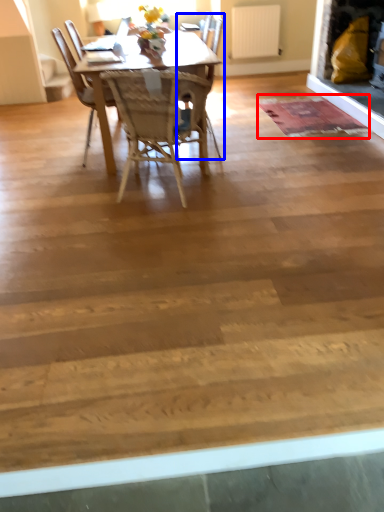
Question: Which point is further to the camera, mat (highlighted by a red box) or chair (highlighted by a blue box)?

Choices:
 (A) mat
 (B) chair

Answer: (A)